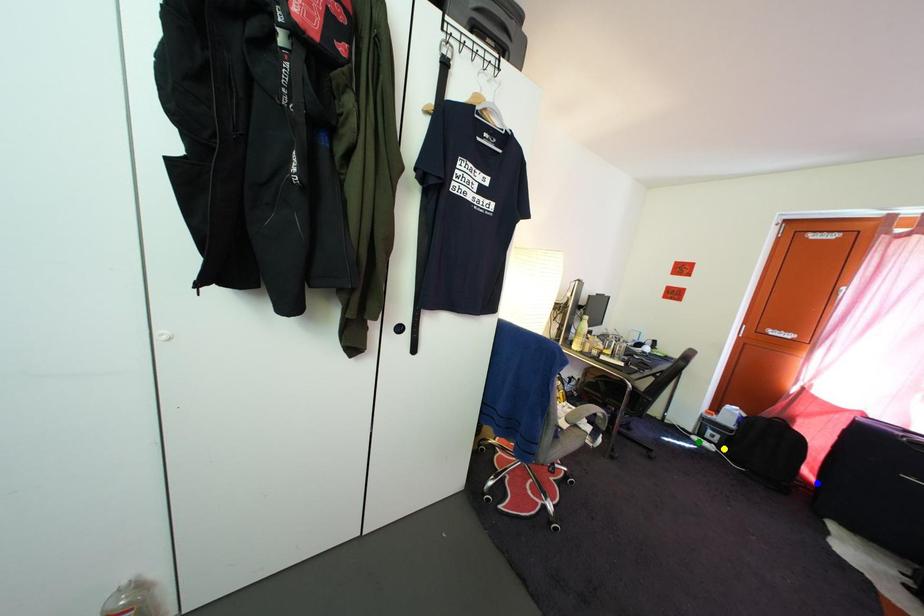
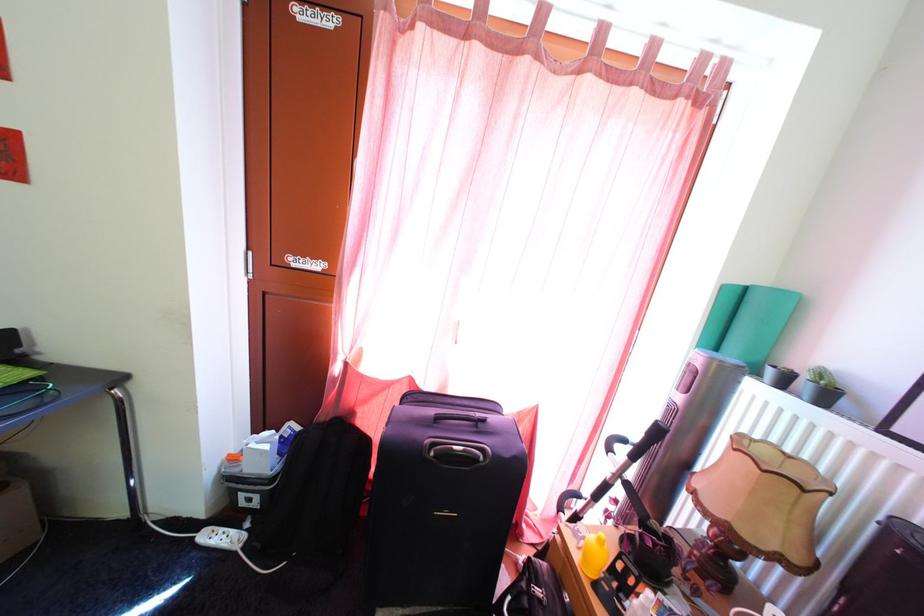
I am providing you with two images of the same scene from different viewpoints. Three points are marked in image1. Which point corresponds to a part or object that is occluded in image2?In image1, three points are marked. Which of them correspond to a part or object that is occluded in image2?Among the three points shown in image1, which one corresponds to a part or object that is no longer visible due to occlusion in image2?

blue point